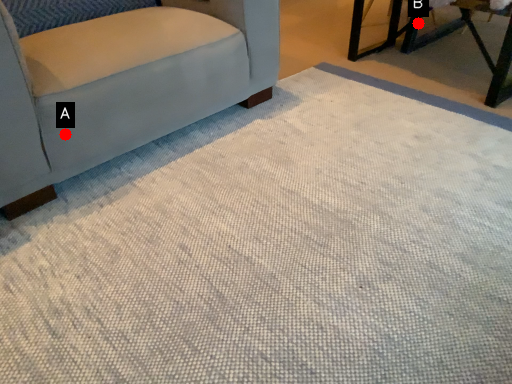
Question: Two points are circled on the image, labeled by A and B beside each circle. Which point appears closest to the camera in this image?

Choices:
 (A) A is closer
 (B) B is closer

Answer: (A)